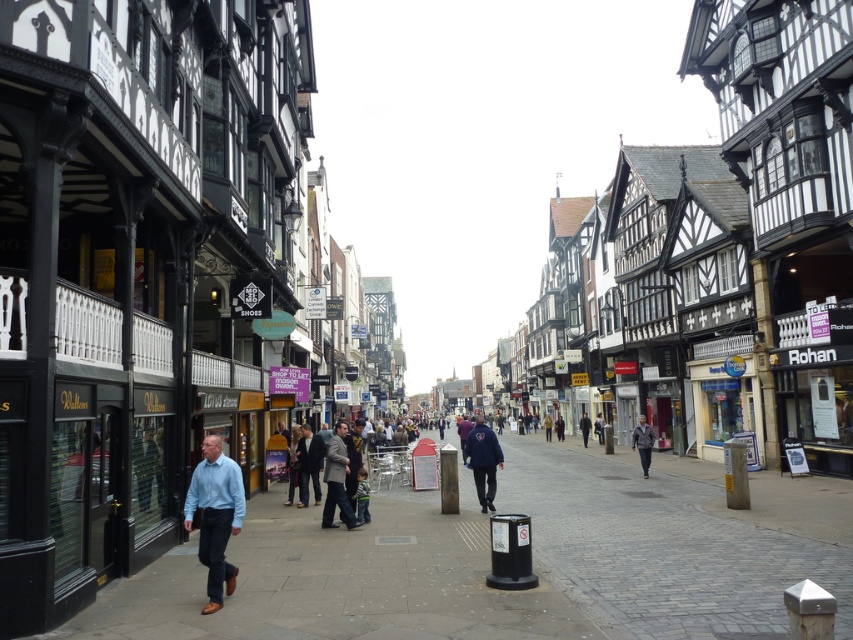
You are a photographer standing on the street and want to capture both the light blue shirt at lower left and the dark blue jacket at center in a single photo. Which person should you focus on first to ensure both are in frame?

You should focus on the dark blue jacket at center first because the light blue shirt at lower left is shorter than the dark blue jacket at center, so adjusting the camera angle to include the shorter person might require framing the taller one first.